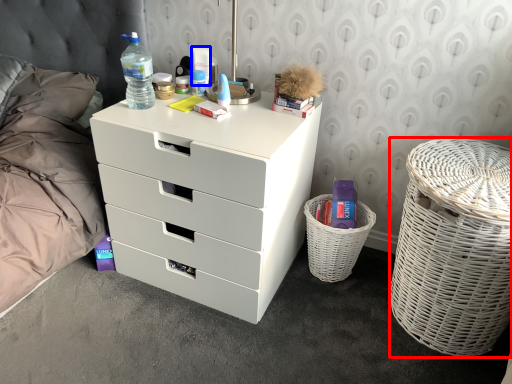
Question: Which point is further to the camera, basket container (highlighted by a red box) or toiletry (highlighted by a blue box)?

Choices:
 (A) basket container
 (B) toiletry

Answer: (B)